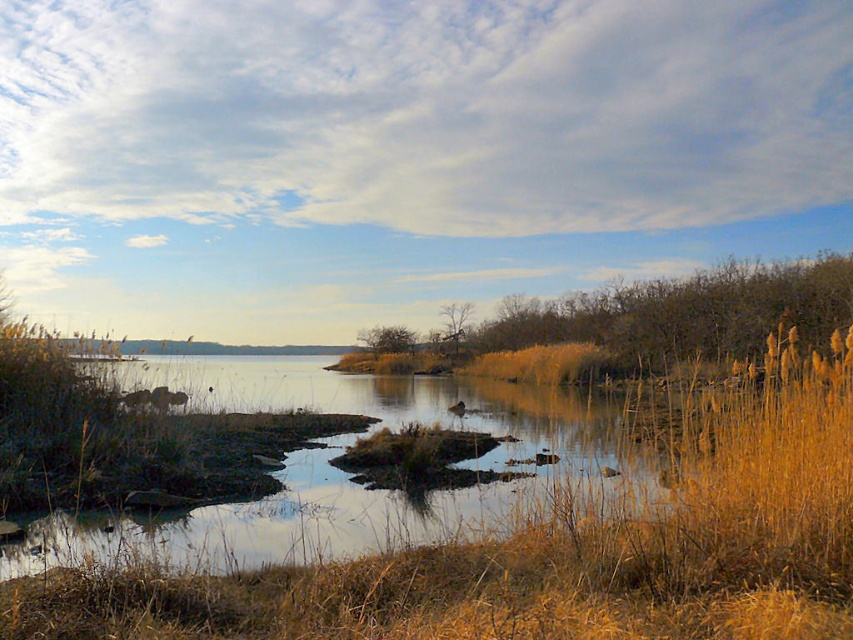
You are standing at the edge of the lake and see two points marked in the image. Which point, point (91, 520) or point (436, 348), is closer to your current position?

Point (91, 520) is closer to the camera than point (436, 348), so it is closer to your current position.

You are an observer standing in the middle of the golden grasses. You see the brown textured tree at right and the brown textured tree at center. Which tree is closer to you?

The brown textured tree at right is closer to you because it is in front of the brown textured tree at center, meaning it is positioned between you and the other tree.

You are standing at the edge of the scene and want to determine the relative heights of the brown grassy river at center and the brown textured tree at right. Which object is taller?

The brown textured tree at right is taller than the brown grassy river at center.